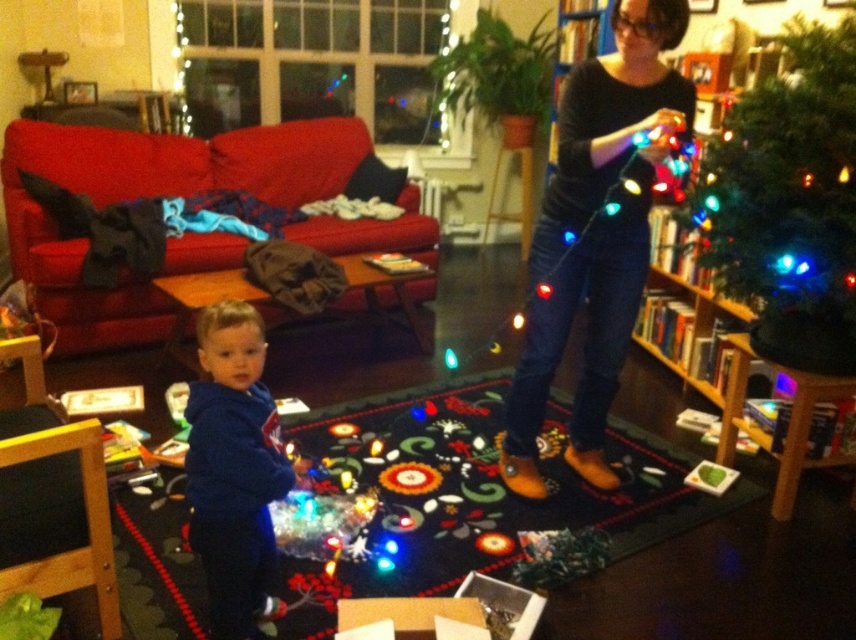
Which of these two, black leather boots at center or blue fleece hoodie at lower left, stands shorter?

blue fleece hoodie at lower left is shorter.

Find the location of `black leather boots at center`. black leather boots at center is located at coordinates (595, 236).

This screenshot has height=640, width=856. In order to click on black leather boots at center in this screenshot , I will do (595, 236).

Does green matte christmas tree at upper right have a greater width compared to blue fleece hoodie at lower left?

Correct, the width of green matte christmas tree at upper right exceeds that of blue fleece hoodie at lower left.

Is green matte christmas tree at upper right to the left of blue fleece hoodie at lower left from the viewer's perspective?

In fact, green matte christmas tree at upper right is to the right of blue fleece hoodie at lower left.

Locate an element on the screen. green matte christmas tree at upper right is located at coordinates (789, 204).

Can you confirm if black leather boots at center is positioned to the left of green matte christmas tree at upper right?

Yes, black leather boots at center is to the left of green matte christmas tree at upper right.

Who is more distant from viewer, (587, 252) or (758, 296)?

The point (758, 296) is more distant.

This screenshot has height=640, width=856. What do you see at coordinates (595, 236) in the screenshot? I see `black leather boots at center` at bounding box center [595, 236].

Identify the location of black leather boots at center. (595, 236).